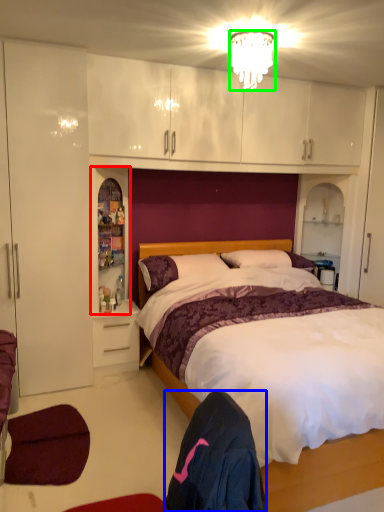
Question: Considering the real-world distances, which object is closest to cabinet (highlighted by a red box)? robe (highlighted by a blue box) or lamp (highlighted by a green box).

Choices:
 (A) robe
 (B) lamp

Answer: (B)